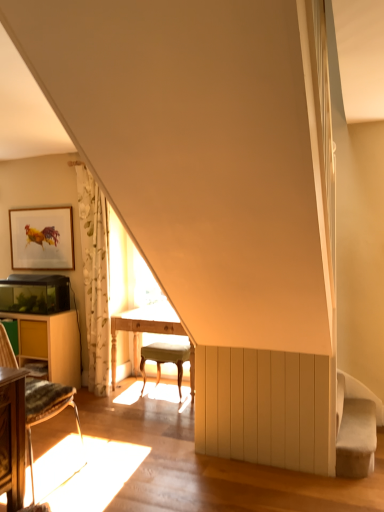
This screenshot has height=512, width=384. Identify the location of free space above velvet beige swivel chair at lower right (from a real-world perspective). (362, 418).